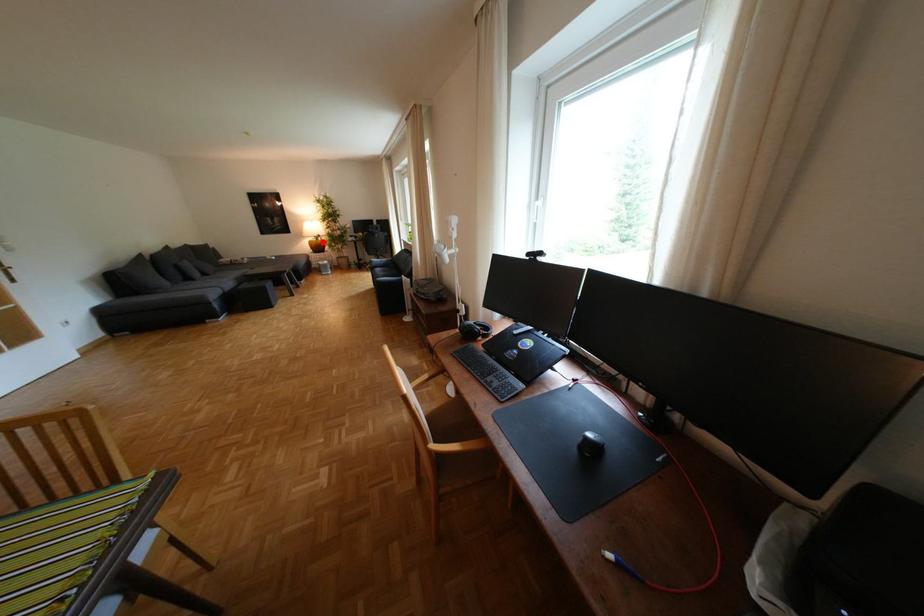
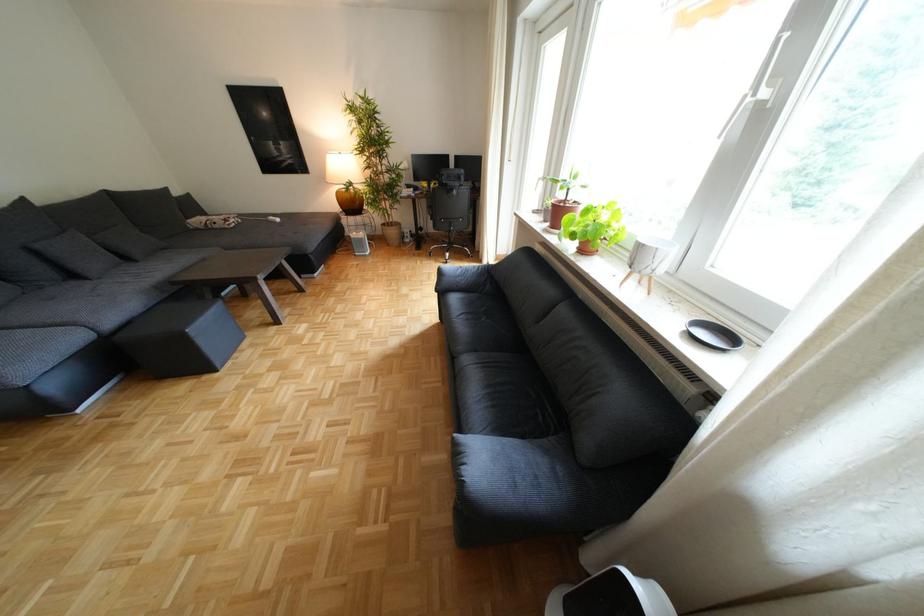
Find the pixel in the second image that matches the highlighted location in the first image.

(351, 193)